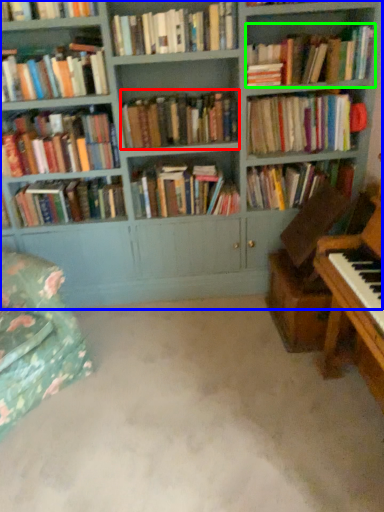
Question: Which is nearer to the book (highlighted by a red box)? bookcase (highlighted by a blue box) or book (highlighted by a green box).

Choices:
 (A) bookcase
 (B) book

Answer: (A)